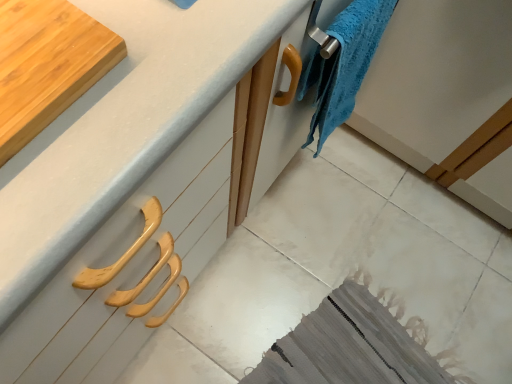
Question: Considering the relative positions of blue fuzzy towel at upper right and wooden cutting board at upper left in the image provided, is blue fuzzy towel at upper right in front of wooden cutting board at upper left?

Choices:
 (A) yes
 (B) no

Answer: (B)

Question: Is wooden cutting board at upper left inside blue fuzzy towel at upper right?

Choices:
 (A) no
 (B) yes

Answer: (A)

Question: Can you confirm if blue fuzzy towel at upper right is taller than wooden cutting board at upper left?

Choices:
 (A) no
 (B) yes

Answer: (B)

Question: Considering the relative sizes of blue fuzzy towel at upper right and wooden cutting board at upper left in the image provided, is blue fuzzy towel at upper right wider than wooden cutting board at upper left?

Choices:
 (A) no
 (B) yes

Answer: (A)

Question: Does blue fuzzy towel at upper right appear on the left side of wooden cutting board at upper left?

Choices:
 (A) yes
 (B) no

Answer: (B)

Question: Is blue fuzzy towel at upper right spatially inside wooden cutting board at upper left, or outside of it?

Choices:
 (A) outside
 (B) inside

Answer: (A)

Question: Considering the relative positions of blue fuzzy towel at upper right and wooden cutting board at upper left in the image provided, is blue fuzzy towel at upper right to the left or to the right of wooden cutting board at upper left?

Choices:
 (A) left
 (B) right

Answer: (B)

Question: From a real-world perspective, is blue fuzzy towel at upper right physically located above or below wooden cutting board at upper left?

Choices:
 (A) below
 (B) above

Answer: (A)

Question: From the image's perspective, is blue fuzzy towel at upper right positioned above or below wooden cutting board at upper left?

Choices:
 (A) below
 (B) above

Answer: (B)

Question: From a real-world perspective, is blue fuzzy towel at upper right above or below white matte countertop at upper left?

Choices:
 (A) below
 (B) above

Answer: (B)

Question: Considering the positions of point (352, 51) and point (46, 337), is point (352, 51) closer or farther from the camera than point (46, 337)?

Choices:
 (A) farther
 (B) closer

Answer: (A)

Question: In terms of size, does blue fuzzy towel at upper right appear bigger or smaller than white matte countertop at upper left?

Choices:
 (A) small
 (B) big

Answer: (A)

Question: Considering the positions of blue fuzzy towel at upper right and white matte countertop at upper left in the image, is blue fuzzy towel at upper right taller or shorter than white matte countertop at upper left?

Choices:
 (A) tall
 (B) short

Answer: (B)

Question: From a real-world perspective, is white matte countertop at upper left physically located above or below wooden cutting board at upper left?

Choices:
 (A) above
 (B) below

Answer: (B)

Question: In the image, is white matte countertop at upper left on the left side or the right side of wooden cutting board at upper left?

Choices:
 (A) right
 (B) left

Answer: (A)